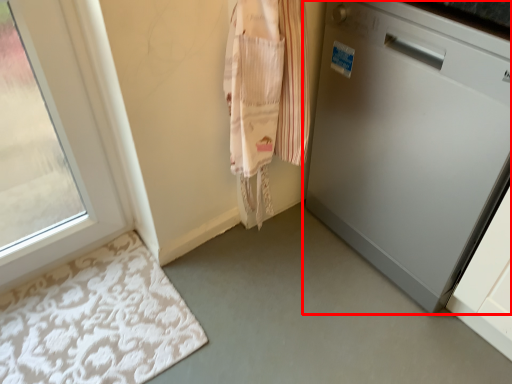
Question: From the image's perspective, what is the correct spatial relationship of home appliance (annotated by the red box) in relation to bath mat?

Choices:
 (A) below
 (B) above

Answer: (B)